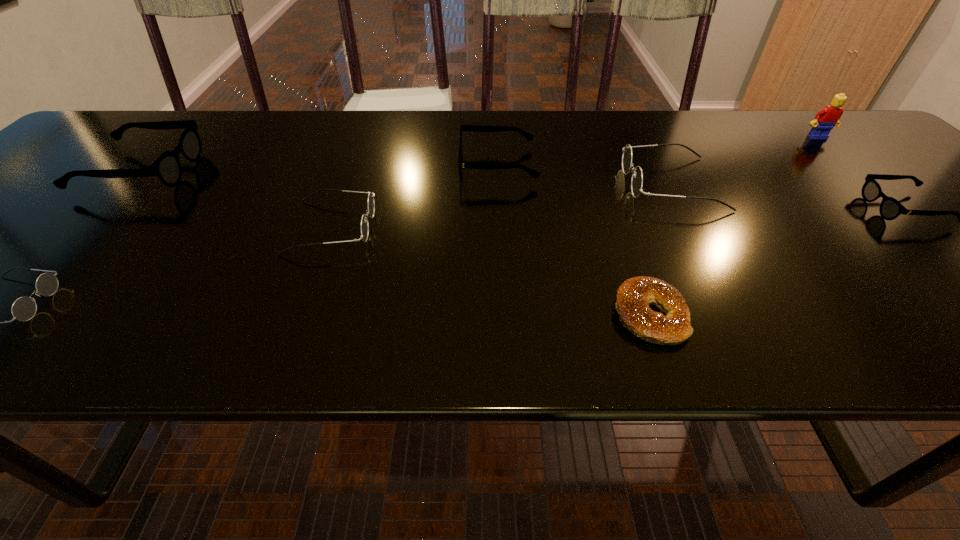
Where is `dark spectacles that stands as the closest to the rightmost spectacles`? The image size is (960, 540). dark spectacles that stands as the closest to the rightmost spectacles is located at coordinates (637, 177).

Find the location of a particular element. Image resolution: width=960 pixels, height=540 pixels. free space that satisfies the following two spatial constraints: 1. on the face of the Lego; 2. on the arms of the leftmost black spectacles is located at coordinates (853, 171).

Find the location of a particular element. The width and height of the screenshot is (960, 540). blank area in the image that satisfies the following two spatial constraints: 1. on the arms of the fifth object from right to left; 2. on the left side of the tan bagel is located at coordinates (506, 315).

You are a GUI agent. You are given a task and a screenshot of the screen. Output one action in this format:
    pyautogui.click(x=<x>, y=<y>)
    Task: Click on the vacant region that satisfies the following two spatial constraints: 1. on the face of the farthest object; 2. through the lenses of the second spectacles from right to left
    This screenshot has width=960, height=540.
    Given the screenshot: What is the action you would take?
    pyautogui.click(x=866, y=183)

Image resolution: width=960 pixels, height=540 pixels. I want to click on vacant space that satisfies the following two spatial constraints: 1. on the back side of the bagel; 2. through the lenses of the fourth spectacles from right to left, so tap(619, 227).

Locate an element on the screen. free space that satisfies the following two spatial constraints: 1. on the face of the Lego; 2. on the arms of the leftmost black spectacles is located at coordinates (853, 171).

I want to click on vacant space that satisfies the following two spatial constraints: 1. on the face of the farthest object; 2. through the lenses of the rightmost dark spectacles, so click(866, 183).

The image size is (960, 540). Find the location of `free space in the image that satisfies the following two spatial constraints: 1. on the arms of the second biggest black spectacles; 2. on the right side of the tan bagel`. free space in the image that satisfies the following two spatial constraints: 1. on the arms of the second biggest black spectacles; 2. on the right side of the tan bagel is located at coordinates (506, 315).